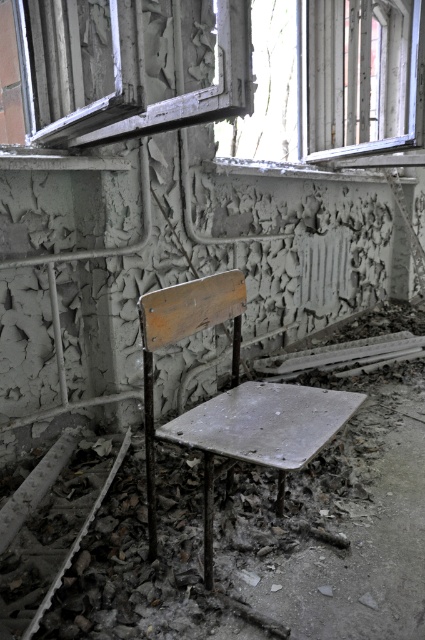
Which of these two, transparent glass window at upper center or white textured frame at upper left, stands taller?

With more height is transparent glass window at upper center.

Between point (331, 51) and point (223, 113), which one is positioned in front?

Positioned in front is point (223, 113).

Describe the element at coordinates (328, 77) in the screenshot. The height and width of the screenshot is (640, 425). I see `transparent glass window at upper center` at that location.

Locate an element on the screen. transparent glass window at upper center is located at coordinates (328, 77).

Does transparent glass window at upper center appear under wooden chair at center?

Incorrect, transparent glass window at upper center is not positioned below wooden chair at center.

Consider the image. Between transparent glass window at upper center and wooden chair at center, which one appears on the right side from the viewer's perspective?

transparent glass window at upper center

You are a GUI agent. You are given a task and a screenshot of the screen. Output one action in this format:
    pyautogui.click(x=<x>, y=<y>)
    Task: Click on the transparent glass window at upper center
    The height and width of the screenshot is (640, 425).
    Given the screenshot: What is the action you would take?
    pyautogui.click(x=328, y=77)

Does white textured frame at upper left appear on the left side of wooden chair at center?

Correct, you'll find white textured frame at upper left to the left of wooden chair at center.

Is white textured frame at upper left thinner than wooden chair at center?

In fact, white textured frame at upper left might be wider than wooden chair at center.

Is point (251, 77) more distant than point (328, 412)?

No, it is not.

Locate an element on the screen. This screenshot has height=640, width=425. white textured frame at upper left is located at coordinates (119, 76).